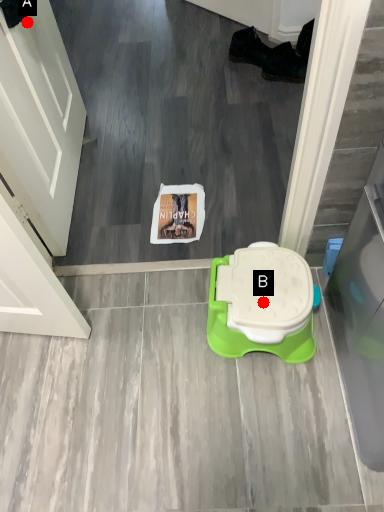
Question: Two points are circled on the image, labeled by A and B beside each circle. Which point appears farthest from the camera in this image?

Choices:
 (A) A is further
 (B) B is further

Answer: (A)